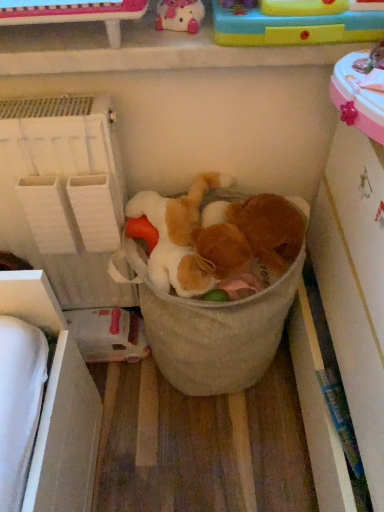
Question: Are fluffy white teddy bear at center, arranged as the 3th toy when viewed from the top, and white fabric shelf at left located far from each other?

Choices:
 (A) no
 (B) yes

Answer: (A)

Question: Can you confirm if fluffy white teddy bear at center, the 1th toy ordered from the bottom, is thinner than white fabric shelf at left?

Choices:
 (A) no
 (B) yes

Answer: (A)

Question: From a real-world perspective, is fluffy white teddy bear at center, arranged as the 3th toy when viewed from the top, physically above white fabric shelf at left?

Choices:
 (A) no
 (B) yes

Answer: (B)

Question: From a real-world perspective, is fluffy white teddy bear at center, the 1th toy ordered from the bottom, located beneath white fabric shelf at left?

Choices:
 (A) no
 (B) yes

Answer: (A)

Question: Is fluffy white teddy bear at center, arranged as the 3th toy when viewed from the top, aimed at white fabric shelf at left?

Choices:
 (A) no
 (B) yes

Answer: (A)

Question: Is fluffy white teddy bear at center, arranged as the 3th toy when viewed from the top, bigger than white fabric shelf at left?

Choices:
 (A) yes
 (B) no

Answer: (B)

Question: Does beige fabric laundry basket at center have a smaller size compared to white fabric shelf at left?

Choices:
 (A) no
 (B) yes

Answer: (A)

Question: Does beige fabric laundry basket at center appear on the left side of white fabric shelf at left?

Choices:
 (A) no
 (B) yes

Answer: (A)

Question: From a real-world perspective, is beige fabric laundry basket at center located higher than white fabric shelf at left?

Choices:
 (A) no
 (B) yes

Answer: (A)

Question: Could you tell me if beige fabric laundry basket at center is turned towards white fabric shelf at left?

Choices:
 (A) yes
 (B) no

Answer: (B)

Question: Does beige fabric laundry basket at center have a greater width compared to white fabric shelf at left?

Choices:
 (A) yes
 (B) no

Answer: (A)

Question: Can you see beige fabric laundry basket at center touching white fabric shelf at left?

Choices:
 (A) no
 (B) yes

Answer: (A)

Question: Would you say beige fabric laundry basket at center is outside matte pink plush at upper center, which ranks as the third toy in bottom-to-top order?

Choices:
 (A) yes
 (B) no

Answer: (A)